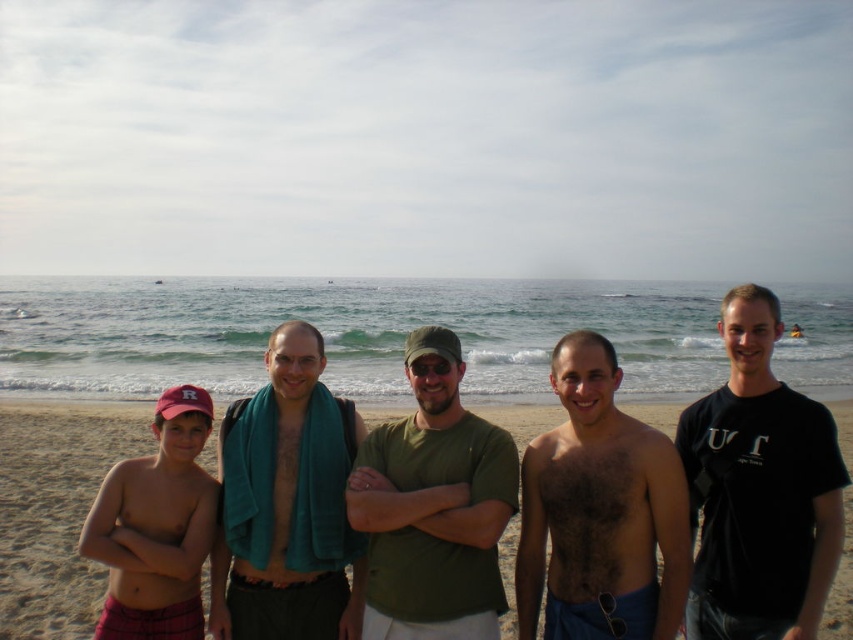
Looking at this image, does teal towel at center have a greater width compared to hairy skin at center?

Yes, teal towel at center is wider than hairy skin at center.

Does teal towel at center have a larger size compared to hairy skin at center?

Actually, teal towel at center might be smaller than hairy skin at center.

The width and height of the screenshot is (853, 640). Describe the element at coordinates (286, 504) in the screenshot. I see `teal towel at center` at that location.

At what (x,y) coordinates should I click in order to perform the action: click on teal towel at center. Please return your answer as a coordinate pair (x, y). The height and width of the screenshot is (640, 853). Looking at the image, I should click on (286, 504).

Is black matte t-shirt at right shorter than red cotton cap at left?

No.

What do you see at coordinates (759, 490) in the screenshot? Image resolution: width=853 pixels, height=640 pixels. I see `black matte t-shirt at right` at bounding box center [759, 490].

Is point (726, 397) farther from viewer compared to point (202, 499)?

No, (726, 397) is closer to viewer.

The image size is (853, 640). Find the location of `black matte t-shirt at right`. black matte t-shirt at right is located at coordinates (759, 490).

Does black matte t-shirt at right have a lesser width compared to hairy skin at center?

Correct, black matte t-shirt at right's width is less than hairy skin at center's.

Is black matte t-shirt at right positioned behind hairy skin at center?

No, it is not.

Which is in front, point (764, 298) or point (543, 445)?

Point (764, 298) is in front.

Where is `black matte t-shirt at right`? This screenshot has width=853, height=640. black matte t-shirt at right is located at coordinates (759, 490).